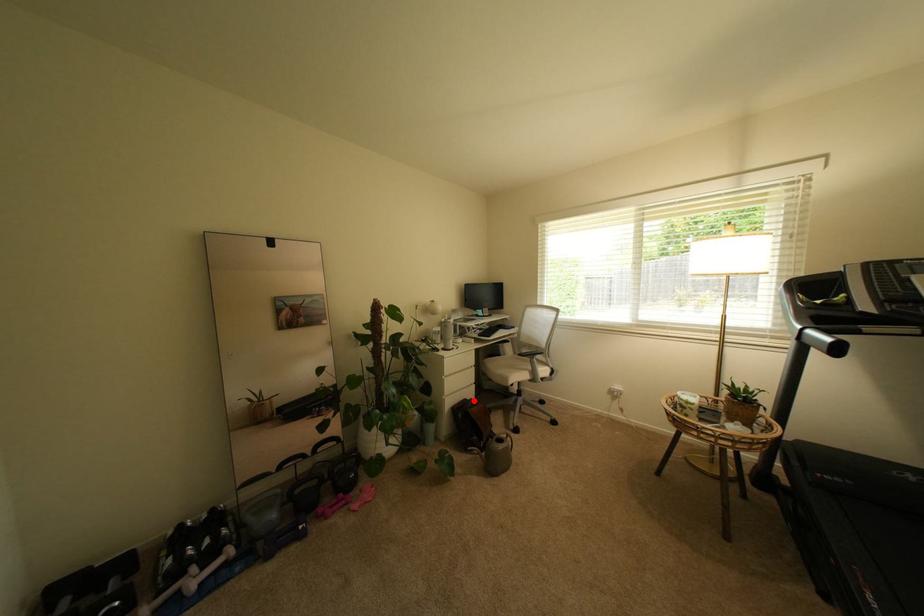
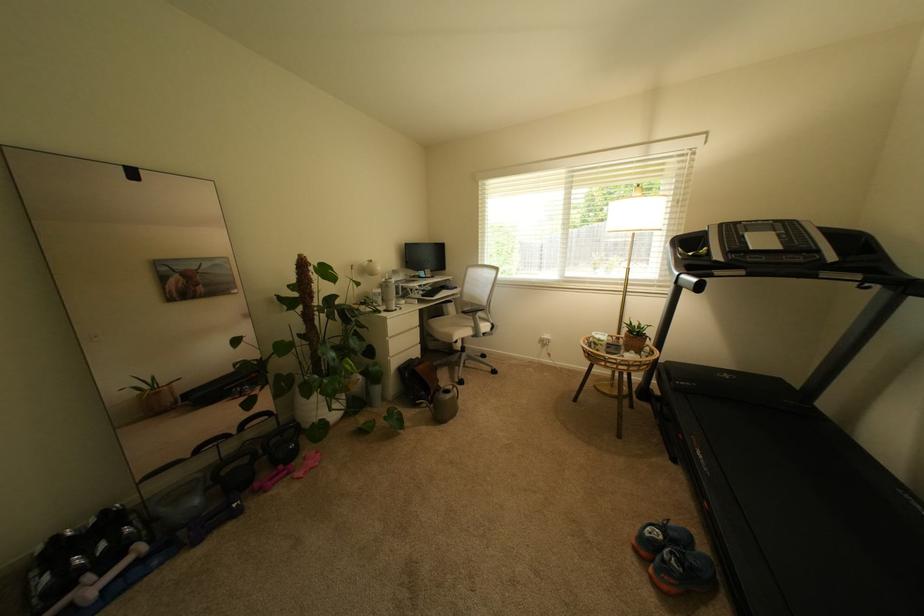
Where in the second image is the point corresponding to the highlighted location from the first image?

(419, 361)